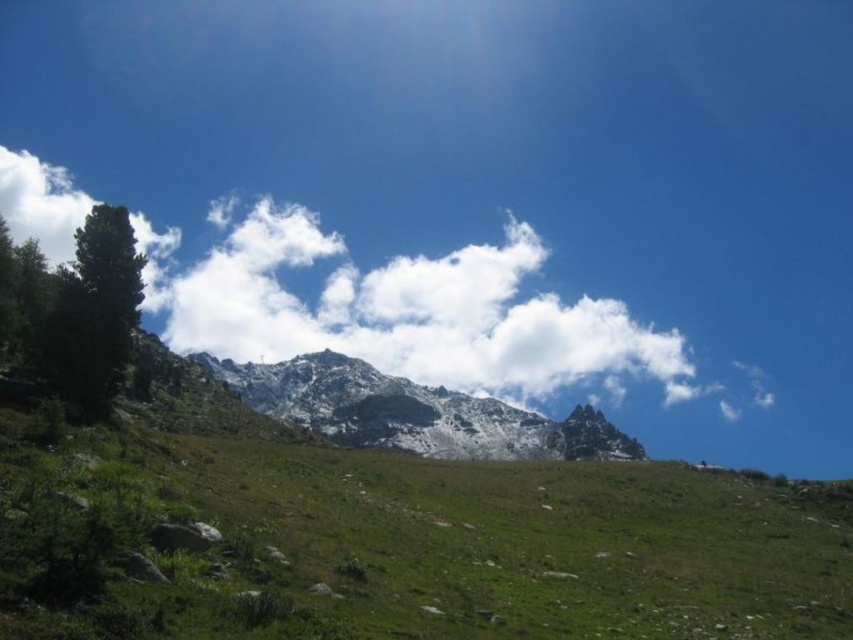
From the picture: Is white fluffy cloud at upper center above white snow-covered mountain at center?

Yes, white fluffy cloud at upper center is above white snow-covered mountain at center.

Does white fluffy cloud at upper center appear under white snow-covered mountain at center?

No, white fluffy cloud at upper center is not below white snow-covered mountain at center.

Locate an element on the screen. This screenshot has height=640, width=853. white fluffy cloud at upper center is located at coordinates (403, 310).

In order to click on white fluffy cloud at upper center in this screenshot , I will do `click(403, 310)`.

Is green grassy at center closer to the viewer compared to white fluffy cloud at upper center?

Yes.

This screenshot has width=853, height=640. Describe the element at coordinates (418, 547) in the screenshot. I see `green grassy at center` at that location.

This screenshot has height=640, width=853. In order to click on green grassy at center in this screenshot , I will do `click(418, 547)`.

This screenshot has height=640, width=853. What are the coordinates of `green grassy at center` in the screenshot? It's located at (418, 547).

Is green grassy at center behind white snow-covered mountain at center?

No, green grassy at center is closer to the viewer.

Can you confirm if green grassy at center is positioned below white snow-covered mountain at center?

Actually, green grassy at center is above white snow-covered mountain at center.

This screenshot has height=640, width=853. Find the location of `green grassy at center`. green grassy at center is located at coordinates (418, 547).

Image resolution: width=853 pixels, height=640 pixels. I want to click on green grassy at center, so [418, 547].